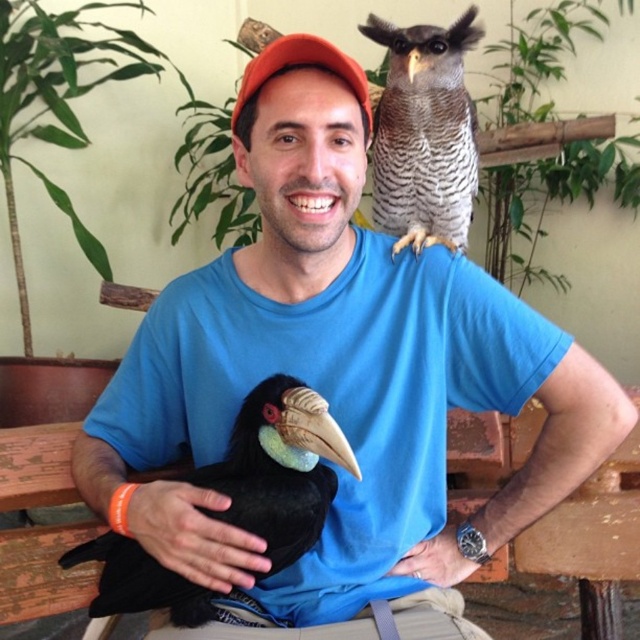
Is black matte hornbill at lower left positioned behind zebra-striped feathers owl at upper right?

No, black matte hornbill at lower left is in front of zebra-striped feathers owl at upper right.

Does black matte hornbill at lower left have a smaller size compared to zebra-striped feathers owl at upper right?

Correct, black matte hornbill at lower left occupies less space than zebra-striped feathers owl at upper right.

Does point (113, 563) come in front of point (394, 253)?

Yes, point (113, 563) is closer to viewer.

At what (x,y) coordinates should I click in order to perform the action: click on black matte hornbill at lower left. Please return your answer as a coordinate pair (x, y). The image size is (640, 640). Looking at the image, I should click on (278, 468).